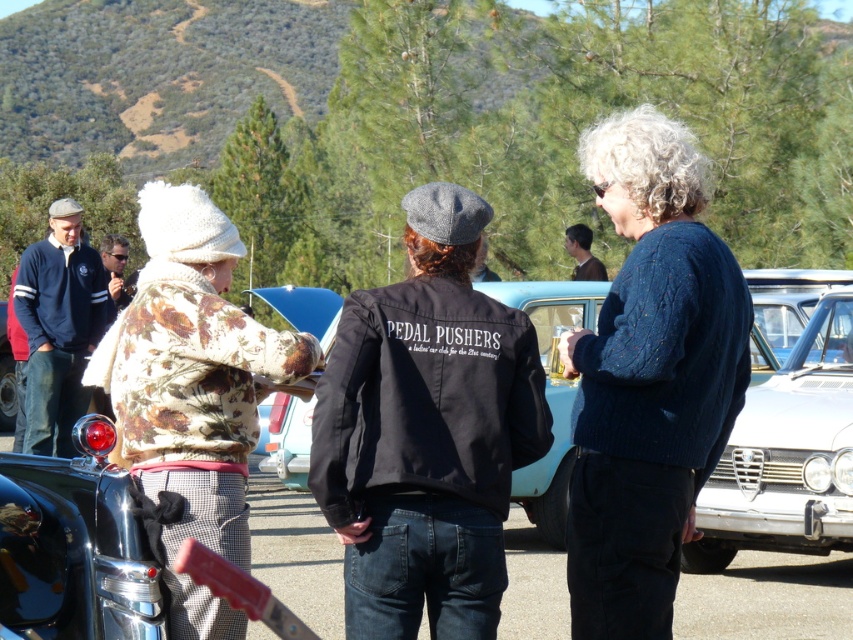
In the scene shown: You are a photographer trying to capture a photo of the black fabric car at center and the black leather jacket at center. If you want to ensure both are fully visible in the frame, which object should you focus on to avoid cropping either?

The black fabric car at center might be wider than black leather jacket at center, so focusing on the wider object, the black fabric car at center, would ensure both are fully visible in the frame.

You are standing at the origin point in the image. The black fabric car at center is located at coordinates 0.614 on the x axis and 0.646 on the y axis. Can you determine its position relative to the origin?

The black fabric car at center is positioned at coordinates 0.614 on the x axis and 0.646 on the y axis, meaning it is located to the right and above the origin point.